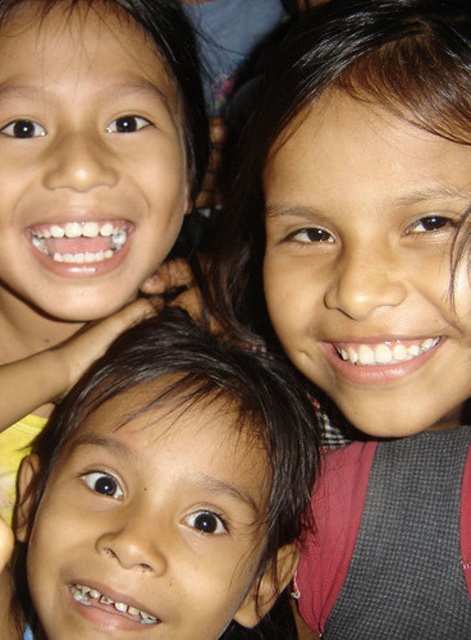
Question: Observing the image, what is the correct spatial positioning of smooth skin face at upper right in reference to brown hair at center?

Choices:
 (A) above
 (B) below

Answer: (A)

Question: Is smooth skin face at upper right wider than brown hair at center?

Choices:
 (A) no
 (B) yes

Answer: (A)

Question: Where is smooth skin face at upper right located in relation to brown hair at center in the image?

Choices:
 (A) above
 (B) below

Answer: (A)

Question: Which of the following is the farthest from the observer?

Choices:
 (A) (387, 168)
 (B) (107, 488)

Answer: (B)